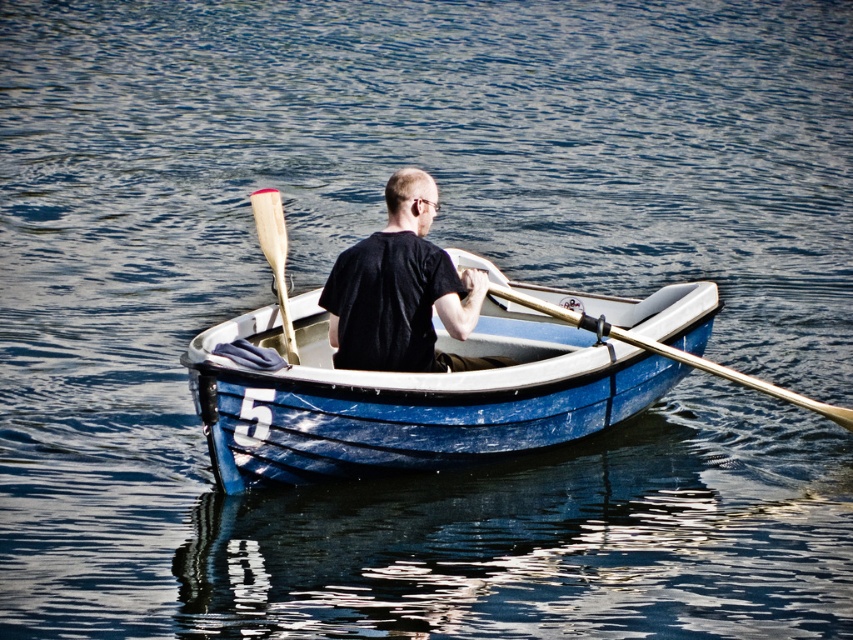
Question: Based on their relative distances, which object is nearer to the black matte shirt at center?

Choices:
 (A) blue polished wood canoe at center
 (B) wooden paddle at center
 (C) wooden polished paddle at center

Answer: (A)

Question: Where is blue polished wood canoe at center located in relation to wooden paddle at center in the image?

Choices:
 (A) left
 (B) right

Answer: (B)

Question: Considering the relative positions of black matte shirt at center and wooden paddle at center in the image provided, where is black matte shirt at center located with respect to wooden paddle at center?

Choices:
 (A) below
 (B) above

Answer: (A)

Question: Which point appears closest to the camera in this image?

Choices:
 (A) tap(419, 326)
 (B) tap(288, 317)
 (C) tap(225, 477)

Answer: (C)

Question: Does black matte shirt at center appear on the left side of wooden paddle at center?

Choices:
 (A) yes
 (B) no

Answer: (B)

Question: Which of the following is the farthest from the observer?

Choices:
 (A) [x=846, y=419]
 (B) [x=553, y=332]
 (C) [x=395, y=248]
 (D) [x=260, y=237]

Answer: (B)